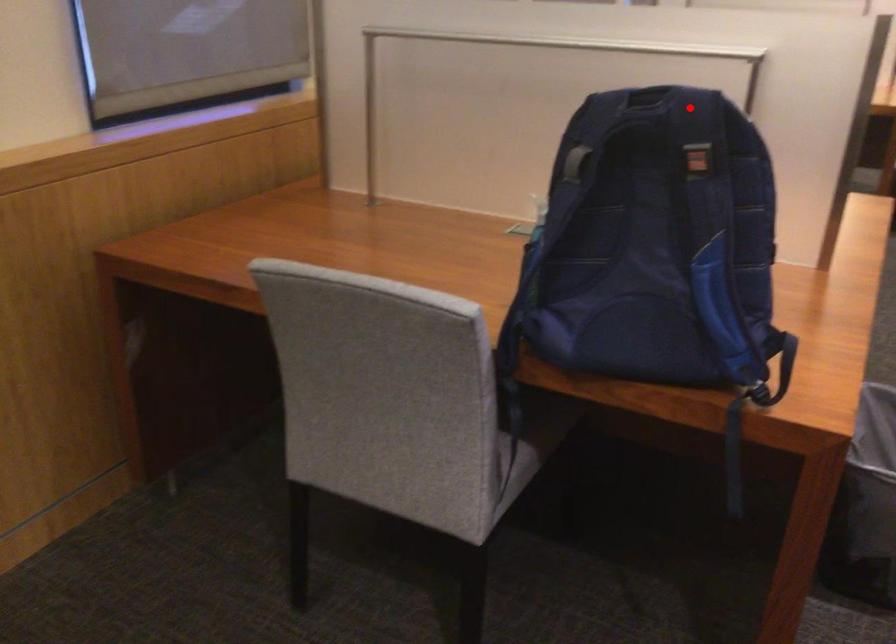
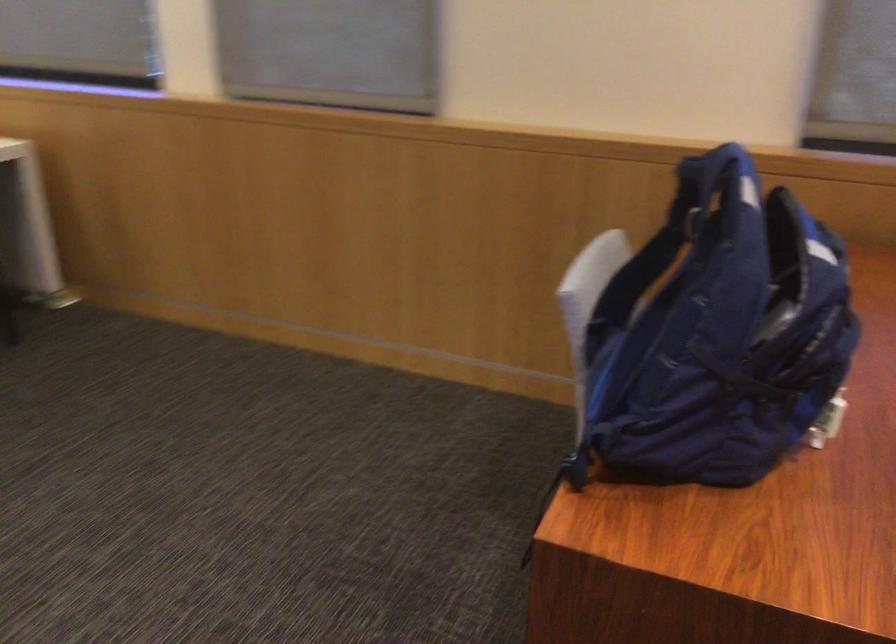
The point at the highlighted location is marked in the first image. Where is the corresponding point in the second image?

(730, 178)